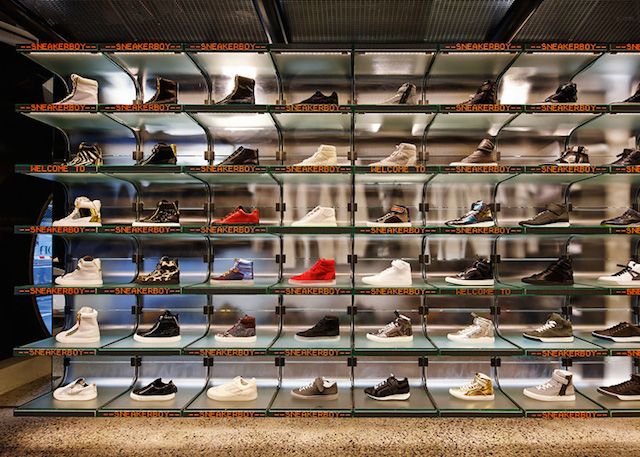
Find the location of a particular element. The width and height of the screenshot is (640, 457). 3rd shelve is located at coordinates (59, 291), (156, 286), (228, 290), (310, 289), (390, 285), (457, 288), (514, 291), (595, 292).